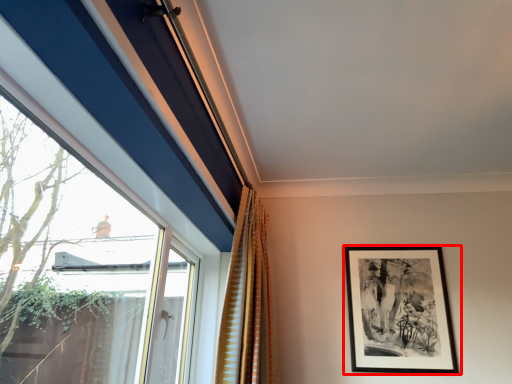
Question: From the image, what is the correct spatial relationship of picture frame (annotated by the red box) in relation to curtain?

Choices:
 (A) left
 (B) right

Answer: (B)